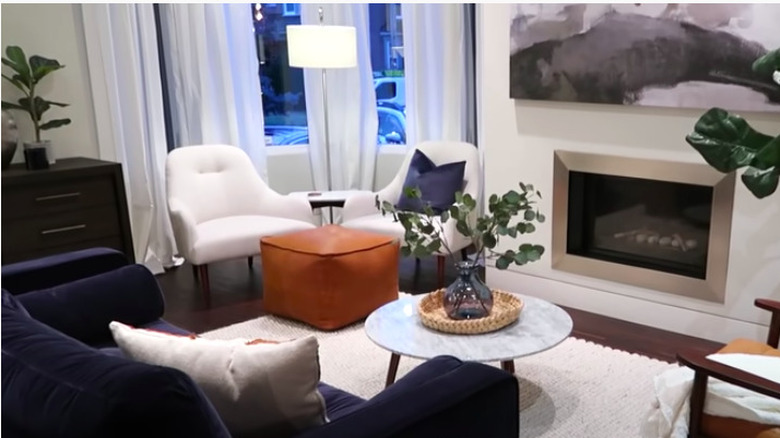
Find the location of `white chairs`. white chairs is located at coordinates (206, 199), (367, 210).